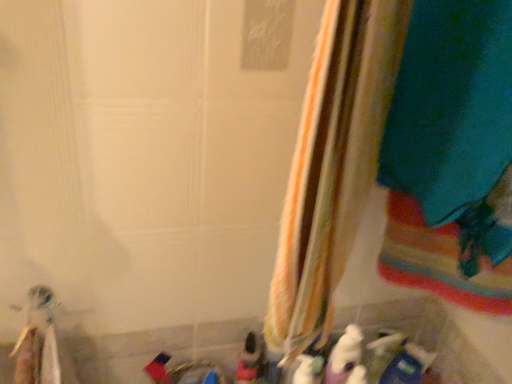
Question: Is striped fabric curtain at center wider or thinner than blue plastic toy at lower right, which is the fifth toy from left to right?

Choices:
 (A) thin
 (B) wide

Answer: (B)

Question: Considering the positions of striped fabric curtain at center and blue plastic toy at lower right, which is the fifth toy from left to right, in the image, is striped fabric curtain at center bigger or smaller than blue plastic toy at lower right, which is the fifth toy from left to right,?

Choices:
 (A) small
 (B) big

Answer: (B)

Question: Estimate the real-world distances between objects in this image. Which object is closer to the matte plastic toy at lower center, acting as the 4th toy starting from the right?

Choices:
 (A) striped fabric curtain at center
 (B) white plastic toothbrush at lower left, the first toy from the left
 (C) blue plastic toy at lower right, the first toy in the right-to-left sequence
 (D) white plush toy at lower center, marked as the 3th toy in a left-to-right arrangement
 (E) white matte bottle at lower center, which is the 2th toy in right-to-left order

Answer: (D)

Question: Estimate the real-world distances between objects in this image. Which object is farther from the white matte bottle at lower center, which is the fourth toy in left-to-right order?

Choices:
 (A) white plastic toothbrush at lower left, the first toy from the left
 (B) matte plastic toy at lower center, acting as the 4th toy starting from the right
 (C) striped fabric curtain at center
 (D) white plush toy at lower center, marked as the 3th toy in a left-to-right arrangement
 (E) blue plastic toy at lower right, which is the fifth toy from left to right

Answer: (A)